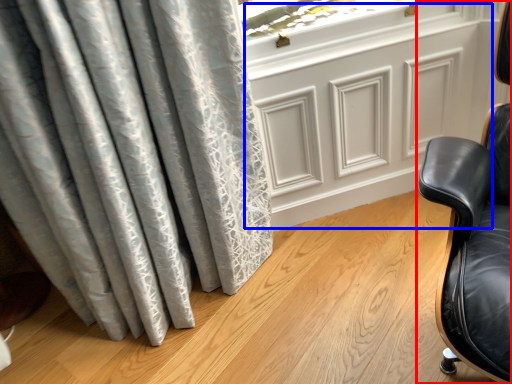
Question: Which of the following is the farthest to the observer, chair (highlighted by a red box) or screen door (highlighted by a blue box)?

Choices:
 (A) chair
 (B) screen door

Answer: (B)